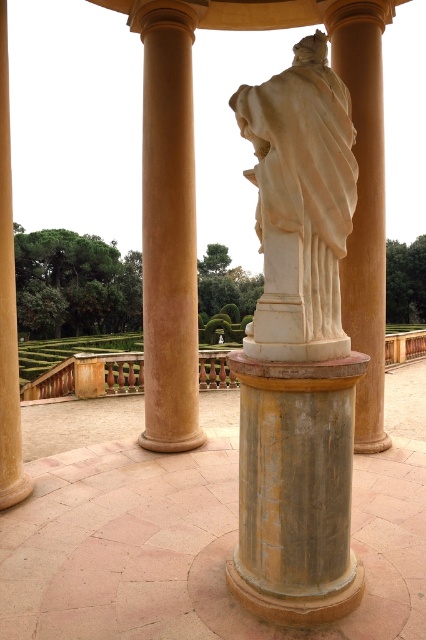
Is white marble statue at center smaller than smooth beige column at center?

Indeed, white marble statue at center has a smaller size compared to smooth beige column at center.

Can you confirm if white marble statue at center is bigger than smooth beige column at center?

Incorrect, white marble statue at center is not larger than smooth beige column at center.

The width and height of the screenshot is (426, 640). What do you see at coordinates (301, 204) in the screenshot?
I see `white marble statue at center` at bounding box center [301, 204].

In order to click on white marble statue at center in this screenshot , I will do `click(301, 204)`.

Between point (367, 49) and point (0, 410), which one is positioned in front?

Point (0, 410) is in front.

Is point (362, 273) more distant than point (14, 339)?

Yes, point (362, 273) is farther from viewer.

Identify the location of white marble column at center. Image resolution: width=426 pixels, height=640 pixels. 365,202.

Does smooth beige column at center appear on the left side of smooth beige column at left?

Indeed, smooth beige column at center is positioned on the left side of smooth beige column at left.

Can you confirm if smooth beige column at center is positioned above smooth beige column at left?

Indeed, smooth beige column at center is positioned over smooth beige column at left.

Does point (169, 307) lie in front of point (6, 387)?

No.

Identify the location of smooth beige column at center. (169, 225).